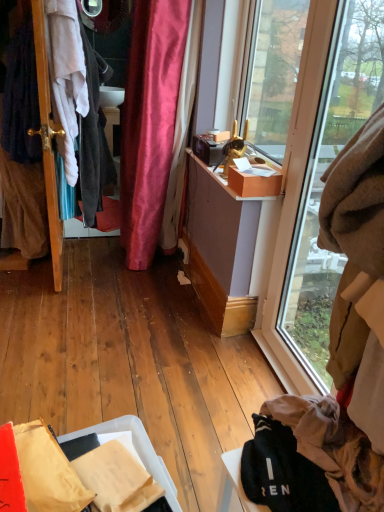
Image resolution: width=384 pixels, height=512 pixels. In order to click on free space above matte cardboard box at upper right (from a real-world perspective) in this screenshot , I will do `click(266, 167)`.